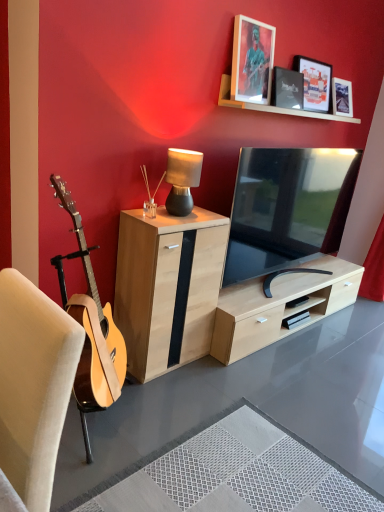
Question: Is matte black picture frame at upper center, which appears as the third picture frame when viewed from the left, not inside matte black table lamp at center?

Choices:
 (A) yes
 (B) no

Answer: (A)

Question: Considering the relative positions of matte black picture frame at upper center, which appears as the third picture frame when viewed from the left, and matte black table lamp at center in the image provided, is matte black picture frame at upper center, which appears as the third picture frame when viewed from the left, to the left of matte black table lamp at center from the viewer's perspective?

Choices:
 (A) no
 (B) yes

Answer: (A)

Question: Is matte black picture frame at upper center, which appears as the third picture frame when viewed from the left, next to matte black table lamp at center and touching it?

Choices:
 (A) no
 (B) yes

Answer: (A)

Question: From a real-world perspective, is matte black picture frame at upper center, which ranks as the 1th picture frame in right-to-left order, over matte black table lamp at center?

Choices:
 (A) no
 (B) yes

Answer: (B)

Question: Is matte black picture frame at upper center, which appears as the third picture frame when viewed from the left, oriented towards matte black table lamp at center?

Choices:
 (A) yes
 (B) no

Answer: (B)

Question: From the image's perspective, is natural wood cabinet at center located above or below white textured rug at lower center?

Choices:
 (A) below
 (B) above

Answer: (B)

Question: Is natural wood cabinet at center in front of or behind white textured rug at lower center in the image?

Choices:
 (A) behind
 (B) front

Answer: (A)

Question: Is point (137, 244) closer or farther from the camera than point (327, 494)?

Choices:
 (A) farther
 (B) closer

Answer: (A)

Question: In terms of width, does natural wood cabinet at center look wider or thinner when compared to white textured rug at lower center?

Choices:
 (A) wide
 (B) thin

Answer: (B)

Question: Which is correct: beige fabric chair at left is inside black matte picture frame at upper center, marked as the 2th picture frame in a right-to-left arrangement, or outside of it?

Choices:
 (A) inside
 (B) outside

Answer: (B)

Question: From a real-world perspective, is beige fabric chair at left above or below black matte picture frame at upper center, marked as the 2th picture frame in a right-to-left arrangement?

Choices:
 (A) above
 (B) below

Answer: (B)

Question: Is beige fabric chair at left taller or shorter than black matte picture frame at upper center, marked as the 2th picture frame in a right-to-left arrangement?

Choices:
 (A) tall
 (B) short

Answer: (A)

Question: Relative to black matte picture frame at upper center, the 2th picture frame in the left-to-right sequence, is beige fabric chair at left in front or behind?

Choices:
 (A) behind
 (B) front

Answer: (B)

Question: From the image's perspective, is natural wood cabinet at center located above or below matte black picture frame at upper center, which ranks as the 1th picture frame in right-to-left order?

Choices:
 (A) above
 (B) below

Answer: (B)

Question: Based on their positions, is natural wood cabinet at center located to the left or right of matte black picture frame at upper center, which ranks as the 1th picture frame in right-to-left order?

Choices:
 (A) right
 (B) left

Answer: (B)